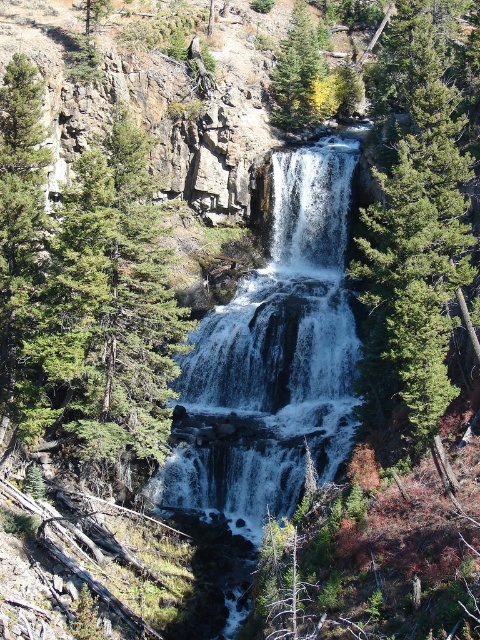
Question: Which of the following is the closest to the observer?

Choices:
 (A) green matte tree at upper center
 (B) green matte tree at center
 (C) green textured tree at center
 (D) white textured water at center

Answer: (B)

Question: Which of the following is the farthest from the observer?

Choices:
 (A) green matte tree at upper center
 (B) green matte tree at center
 (C) white textured water at center
 (D) green textured tree at center

Answer: (A)

Question: Is the position of white textured water at center more distant than that of green textured tree at center?

Choices:
 (A) yes
 (B) no

Answer: (A)

Question: Which point is farther to the camera?

Choices:
 (A) (322, 86)
 (B) (379, 260)
 (C) (262, 412)
 (D) (169, 285)

Answer: (A)

Question: Does white textured water at center have a smaller size compared to green textured tree at center?

Choices:
 (A) yes
 (B) no

Answer: (B)

Question: Does green textured tree at center appear on the right side of green matte tree at upper center?

Choices:
 (A) no
 (B) yes

Answer: (A)